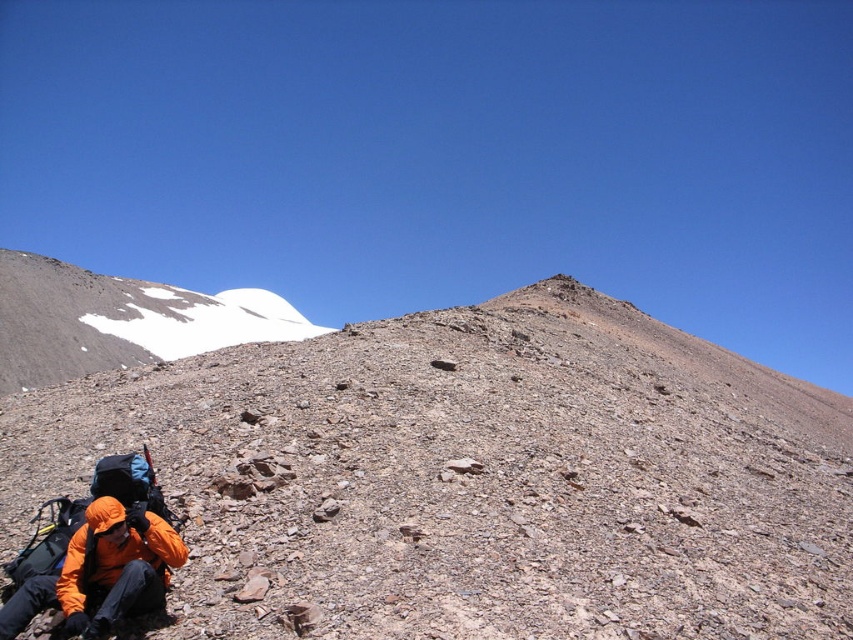
Which is behind, point (548, 609) or point (271, 317)?

The point (271, 317) is more distant.

Who is positioned more to the right, brown rocky mountain at lower left or white snow-covered mountain at upper left?

brown rocky mountain at lower left

Which is in front, point (548, 364) or point (65, 317)?

Positioned in front is point (548, 364).

Locate an element on the screen. brown rocky mountain at lower left is located at coordinates (473, 477).

Is brown rocky mountain at lower left above orange fleece jacket at lower left?

Indeed, brown rocky mountain at lower left is positioned over orange fleece jacket at lower left.

Consider the image. Measure the distance between point (364, 332) and camera.

Point (364, 332) and camera are 35.64 meters apart.

Identify the location of brown rocky mountain at lower left. (473, 477).

Which is below, white snow-covered mountain at upper left or orange fleece jacket at lower left?

Positioned lower is orange fleece jacket at lower left.

Where is `white snow-covered mountain at upper left`? The width and height of the screenshot is (853, 640). white snow-covered mountain at upper left is located at coordinates (119, 321).

In order to click on white snow-covered mountain at upper left in this screenshot , I will do `click(119, 321)`.